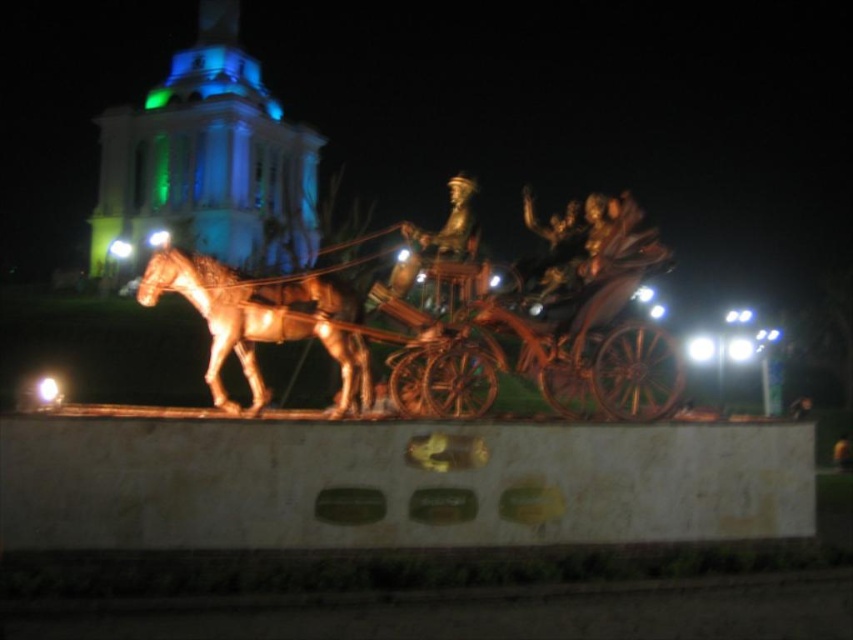
You are standing in front of a nighttime sculpture of a horse and carriage. The sculpture is lit up and has a gold bronze color. There is a point marked at coordinates (x=461, y=326). What object is located at this point?

The point at coordinates (x=461, y=326) marks the gold bronze horse cart at center.